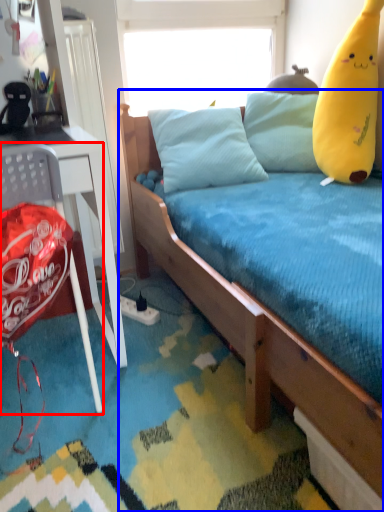
Question: Among these objects, which one is farthest to the camera, chair (highlighted by a red box) or bed (highlighted by a blue box)?

Choices:
 (A) chair
 (B) bed

Answer: (A)